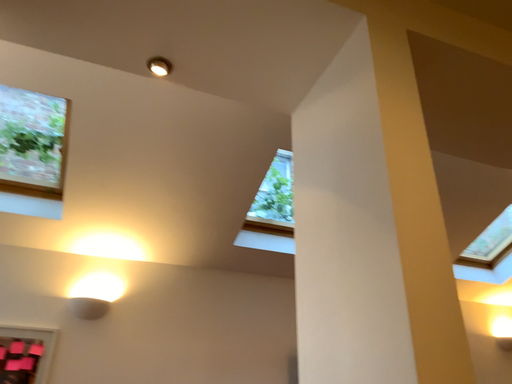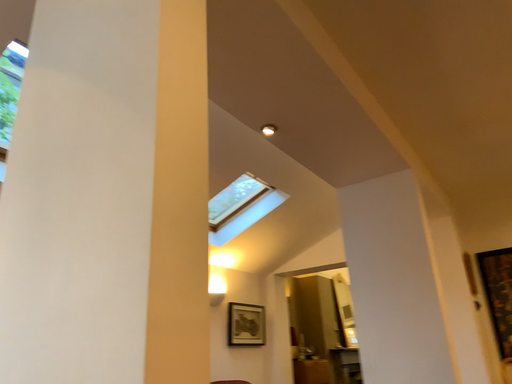
Question: How did the camera likely rotate when shooting the video?

Choices:
 (A) rotated downward
 (B) rotated upward

Answer: (A)